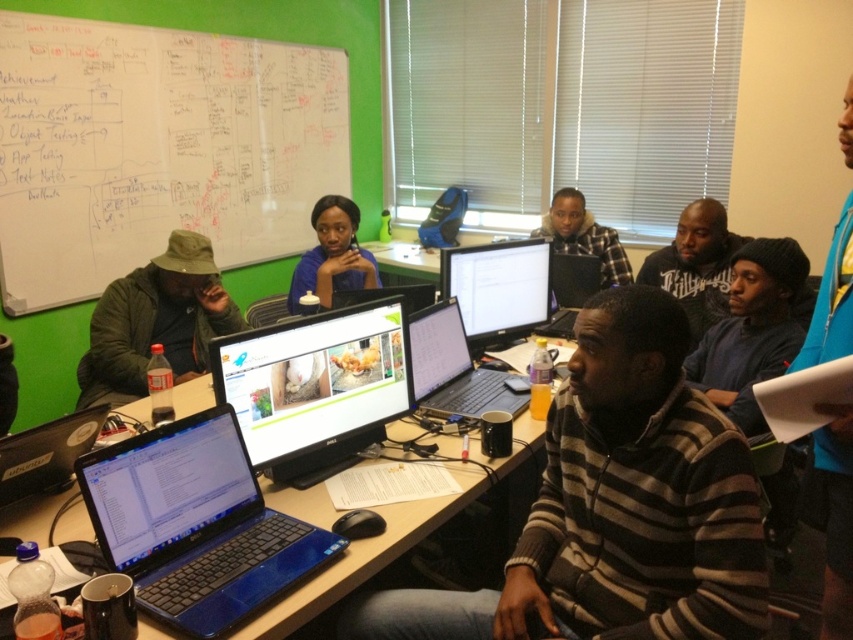
Question: Among these objects, which one is farthest from the camera?

Choices:
 (A) blue glossy laptop at lower left
 (B) blue plastic table at center
 (C) whiteboard at upper left
 (D) matte black monitor at center

Answer: (C)

Question: Can you confirm if black glossy laptop at center is positioned above plaid fabric shirt at center?

Choices:
 (A) no
 (B) yes

Answer: (A)

Question: Is blue glossy laptop at lower left wider than blue plastic table at center?

Choices:
 (A) no
 (B) yes

Answer: (A)

Question: Considering the real-world distances, which object is closest to the dark gray hoodie at center?

Choices:
 (A) blue plastic table at center
 (B) striped sweater at center
 (C) matte black monitor at center
 (D) green matte jacket at left

Answer: (C)

Question: Can you confirm if black glossy laptop at center is smaller than black plastic laptop at lower left?

Choices:
 (A) yes
 (B) no

Answer: (B)

Question: Among these points, which one is nearest to the camera?

Choices:
 (A) (624, 252)
 (B) (0, 10)
 (C) (712, 209)
 (D) (581, 308)

Answer: (D)